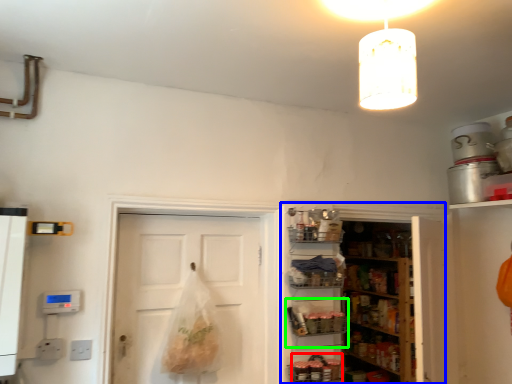
Question: Based on their relative distances, which object is nearer to food (highlighted by a red box)? Choose from cabinetry (highlighted by a blue box) and shelf (highlighted by a green box).

Choices:
 (A) cabinetry
 (B) shelf

Answer: (B)